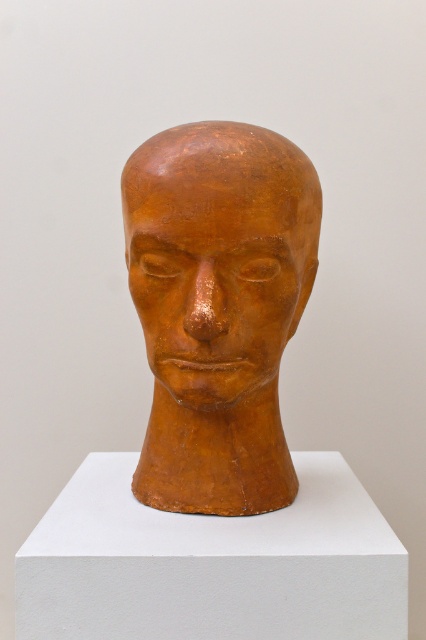
You are an art conservator standing 5 feet away from the matte orange head at center. Can you comfortably examine the sculpture without moving closer?

The matte orange head at center is 35.96 inches from viewer. Since 5 feet equals 60 inches, you are standing 24.04 inches farther away than the sculpture. This distance may make it difficult to examine fine details comfortably. Moving closer to around 35.96 inches would allow for a better examination.

Consider the image. You are an art student observing the sculpture. You notice two parts of the sculpture labeled as the matte orange head at center and the matte clay face at center. Which part is closer to you?

The matte orange head at center is closer to you because the matte clay face at center is positioned behind it.

You are an art conservator examining the sculpture. You need to place a protective cover over both the matte orange head at center and the matte clay face at center. What is the minimum width the cover needs to be to cover both objects?

The minimum width required for the protective cover is 2.47 centimeters, as this is the distance between the matte orange head at center and the matte clay face at center.